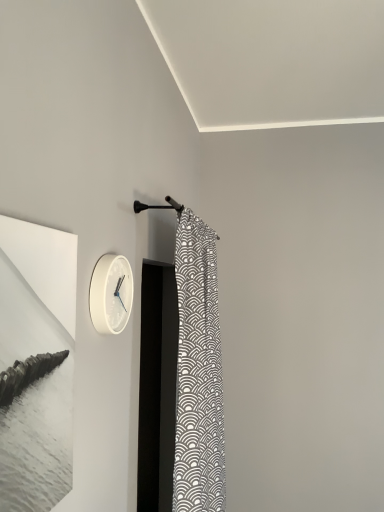
This screenshot has height=512, width=384. What do you see at coordinates (111, 294) in the screenshot?
I see `white plastic wall clock at upper left` at bounding box center [111, 294].

This screenshot has height=512, width=384. In order to click on white plastic wall clock at upper left in this screenshot , I will do `click(111, 294)`.

This screenshot has width=384, height=512. In order to click on white plastic wall clock at upper left in this screenshot , I will do `click(111, 294)`.